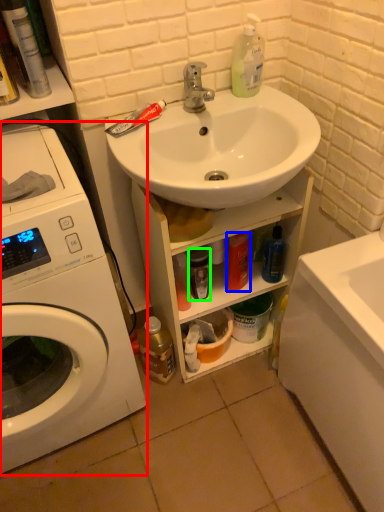
Question: Estimate the real-world distances between objects in this image. Which object is farther from washing machine (highlighted by a red box), toiletry (highlighted by a blue box) or toiletry (highlighted by a green box)?

Choices:
 (A) toiletry
 (B) toiletry

Answer: (A)